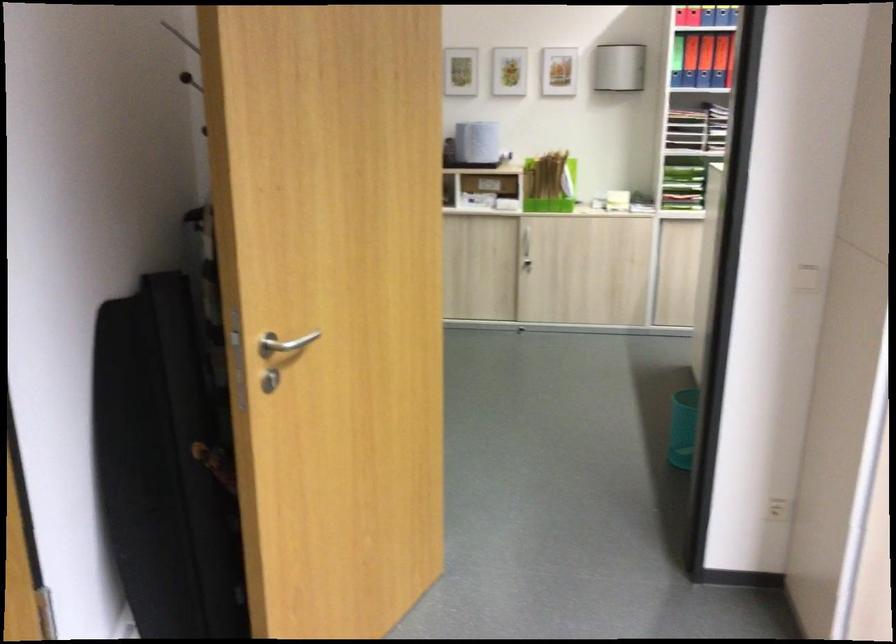
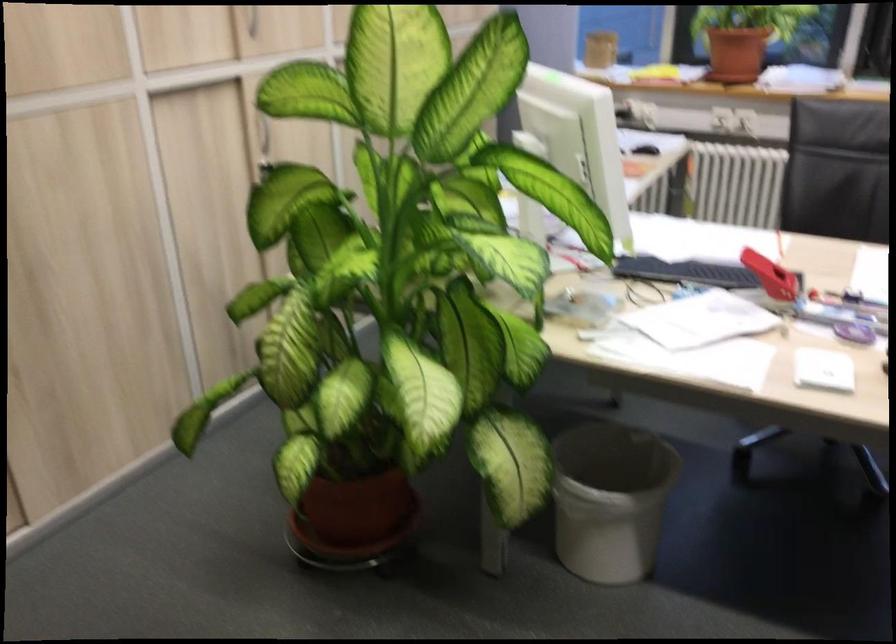
First-person continuous shooting, in which direction is the camera rotating?

The camera rotated toward right-down.